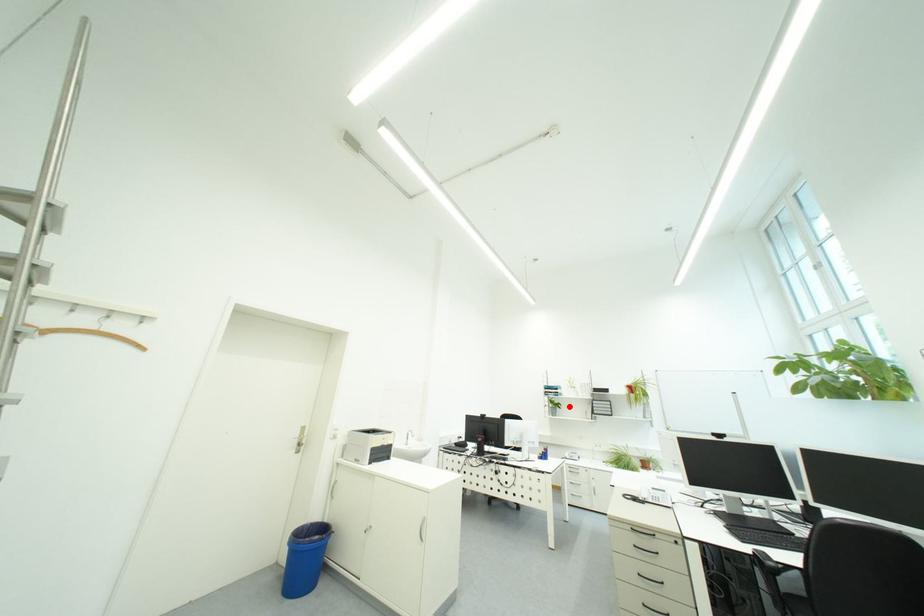
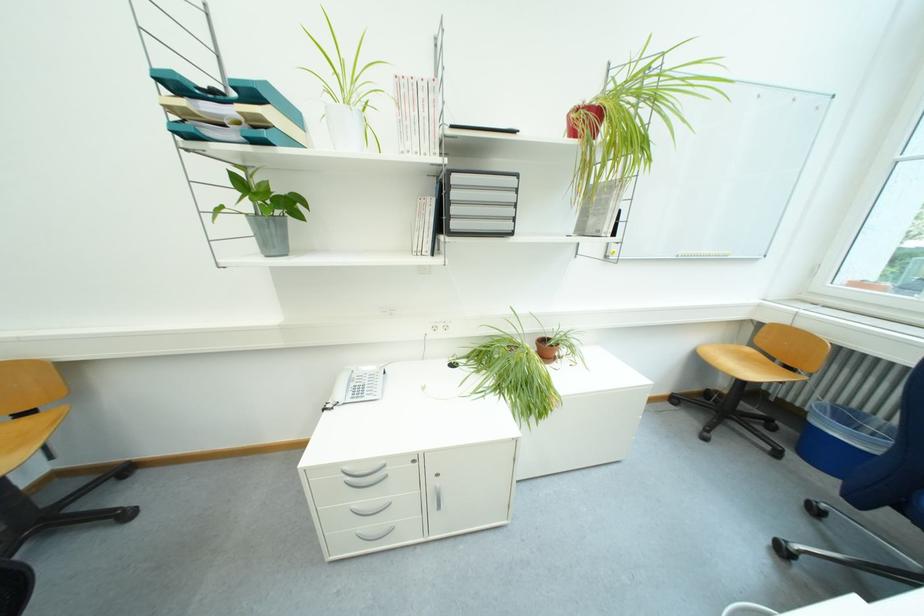
Question: I am providing you with two images of the same scene from different viewpoints. In image1, a red point is highlighted. Considering the same 3D point in image2, which of the following is correct?

Choices:
 (A) It is closer
 (B) It is farther

Answer: (A)